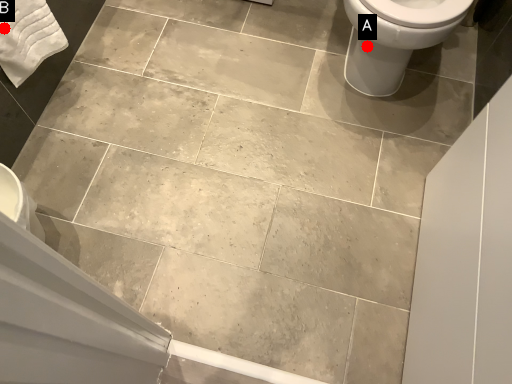
Question: Two points are circled on the image, labeled by A and B beside each circle. Among these points, which one is farthest from the camera?

Choices:
 (A) A is further
 (B) B is further

Answer: (A)